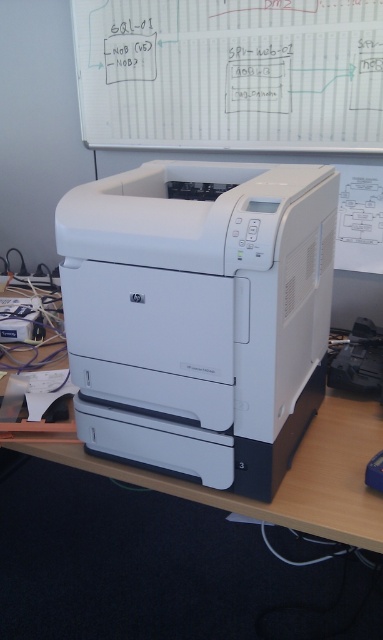
Question: Which point appears closest to the camera in this image?

Choices:
 (A) (289, 348)
 (B) (381, 518)

Answer: (B)

Question: Observing the image, what is the correct spatial positioning of white plastic printer at center in reference to white matte computer desk at center?

Choices:
 (A) right
 (B) left

Answer: (A)

Question: Is white plastic printer at center positioned before white matte computer desk at center?

Choices:
 (A) no
 (B) yes

Answer: (B)

Question: Can you confirm if white plastic printer at center is positioned below white matte computer desk at center?

Choices:
 (A) yes
 (B) no

Answer: (B)

Question: Which of the following is the closest to the observer?

Choices:
 (A) (343, 417)
 (B) (230, 288)

Answer: (B)

Question: Among these points, which one is nearest to the camera?

Choices:
 (A) (176, 250)
 (B) (353, 442)

Answer: (A)